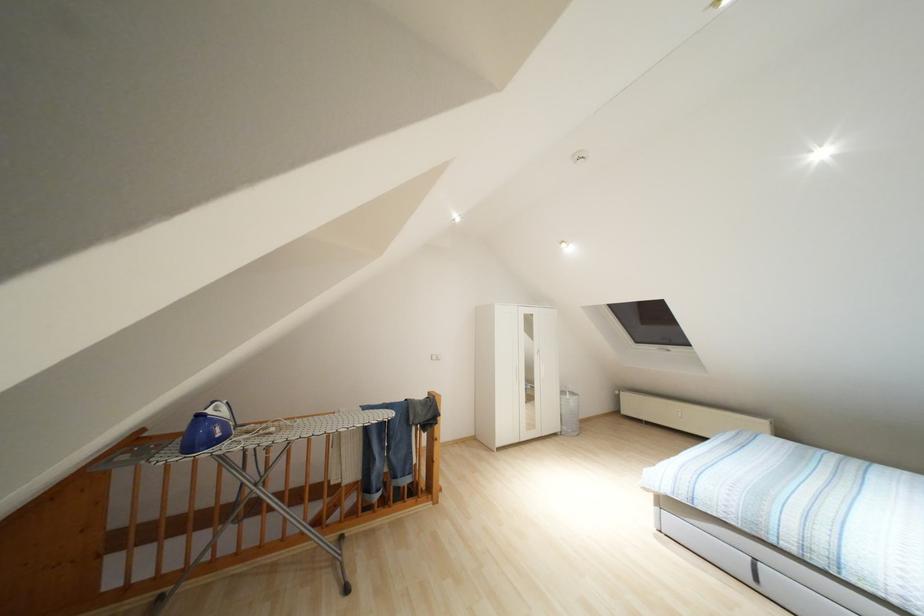
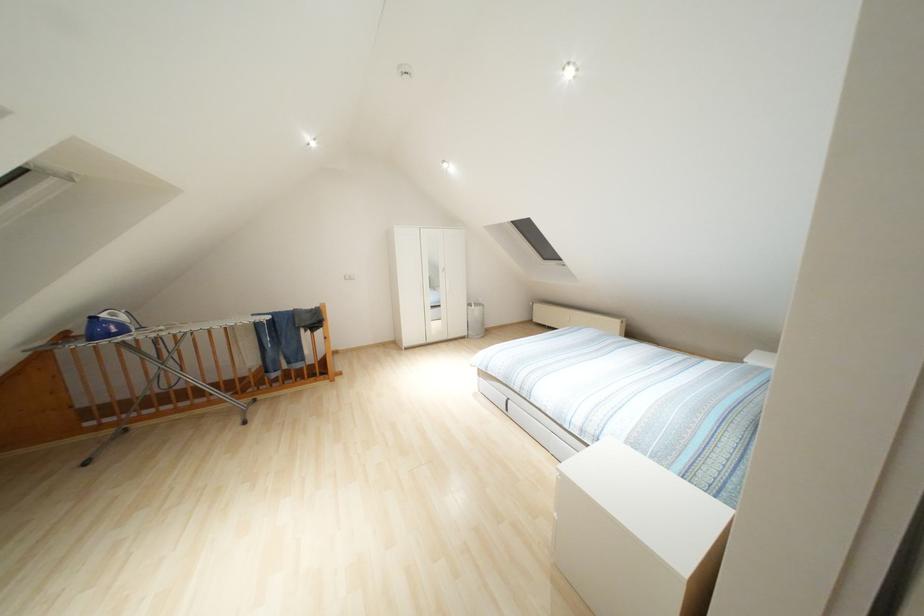
Question: In a continuous first-person perspective shot, in which direction is the camera moving?

Choices:
 (A) Left
 (B) Right
 (C) Forward
 (D) Backward

Answer: (B)